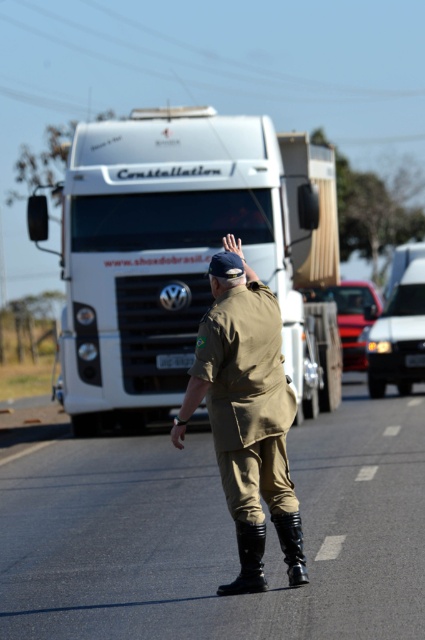
You are a pedestrian trying to cross the road safely. You see the black rubber boots at center and the white glossy truck at center. Which object is closer to you?

The black rubber boots at center is closer to the viewer than the white glossy truck at center.

You are a pedestrian observing the scene. You notice the khaki uniform at center and the black leather boot at center. Which object is closer to you?

The khaki uniform at center is positioned over the black leather boot at center, so the khaki uniform at center is closer to you.

You are a delivery driver who needs to park your van near the black rubber boots at center and the white glossy truck at center. Which object takes up more space on the road?

The white glossy truck at center takes up more space on the road than the black rubber boots at center because the black rubber boots at center occupies less space than white glossy truck at center.